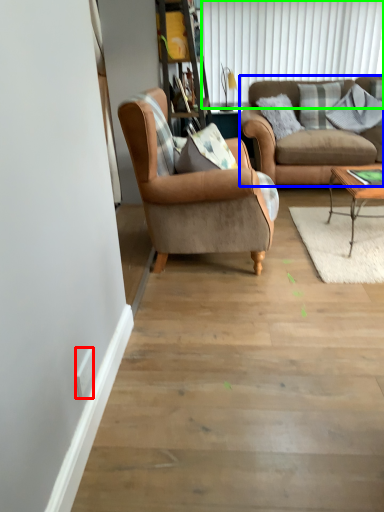
Question: Considering the real-world distances, which object is closest to power outlet (highlighted by a red box)? studio couch (highlighted by a blue box) or shutter (highlighted by a green box).

Choices:
 (A) studio couch
 (B) shutter

Answer: (A)